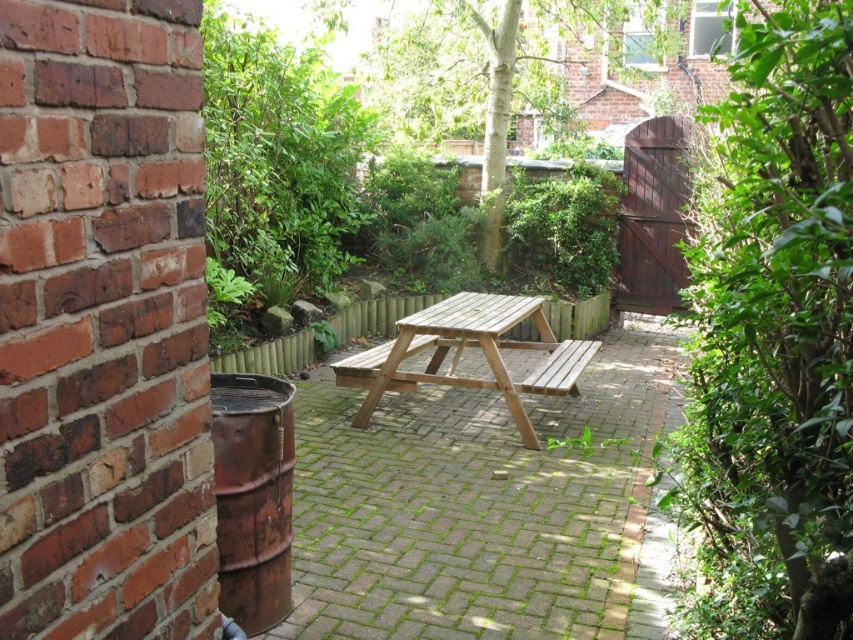
You are planning to set up a garden party in the backyard and need to place a large centerpiece between the wooden picnic table at center and the natural wood picnic table at center. Based on their positions, which table should the centerpiece be closer to?

The wooden picnic table at center is to the left of the natural wood picnic table at center, so the centerpiece should be placed closer to the natural wood picnic table at center since it is on the right side.

You are a painter who needs to set up an easel between the natural wood picnic table at center and the wooden bench at center. The easel requires at least 18 inches of space to be placed comfortably. Based on the scene, can you determine if there is enough space between them for your easel?

The distance between the natural wood picnic table at center and the wooden bench at center is 16.20 inches, which is less than the required 18 inches. Therefore, there isn t enough space to place the easel comfortably between them.